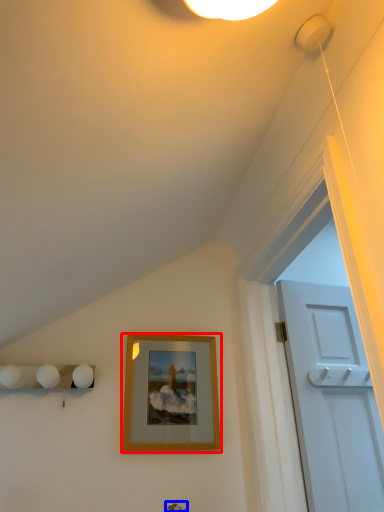
Question: Which object is closer to the camera taking this photo, picture frame (highlighted by a red box) or door handle (highlighted by a blue box)?

Choices:
 (A) picture frame
 (B) door handle

Answer: (B)